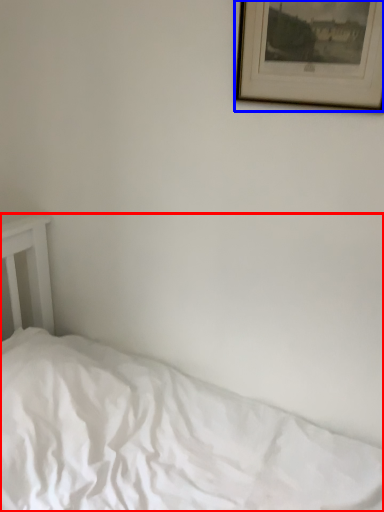
Question: Which object is closer to the camera taking this photo, bed (highlighted by a red box) or picture frame (highlighted by a blue box)?

Choices:
 (A) bed
 (B) picture frame

Answer: (A)